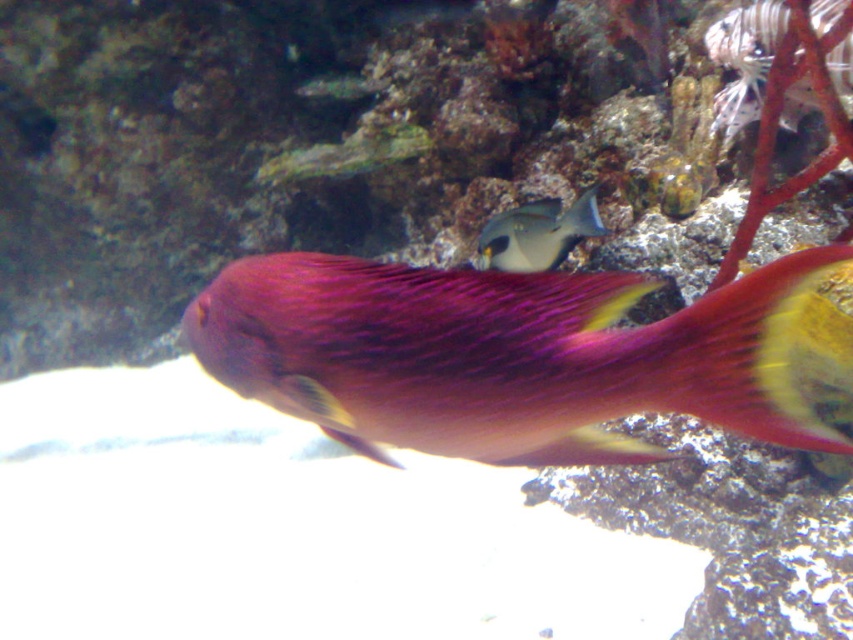
Question: Which point appears closest to the camera in this image?

Choices:
 (A) (729, 120)
 (B) (401, 442)

Answer: (B)

Question: Can you confirm if shiny pink fish at center is positioned to the right of white spiky fish at upper right?

Choices:
 (A) yes
 (B) no

Answer: (B)

Question: Which object is the closest to the shiny pink fish at center?

Choices:
 (A) white spiky fish at upper right
 (B) gray matte fish at center

Answer: (B)

Question: Does shiny pink fish at center have a lesser width compared to gray matte fish at center?

Choices:
 (A) yes
 (B) no

Answer: (B)

Question: Considering the real-world distances, which object is closest to the shiny pink fish at center?

Choices:
 (A) gray matte fish at center
 (B) white spiky fish at upper right

Answer: (A)

Question: From the image, what is the correct spatial relationship of shiny pink fish at center in relation to white spiky fish at upper right?

Choices:
 (A) above
 (B) below

Answer: (B)